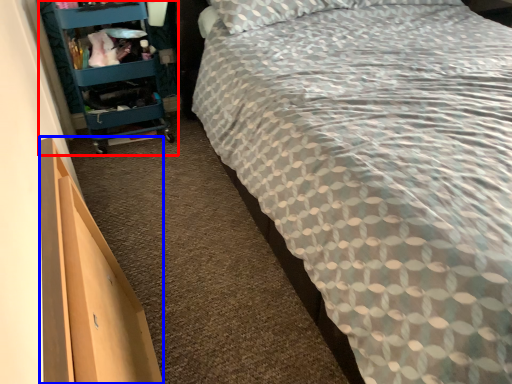
Question: Among these objects, which one is nearest to the camera, furniture (highlighted by a red box) or drawer (highlighted by a blue box)?

Choices:
 (A) furniture
 (B) drawer

Answer: (B)